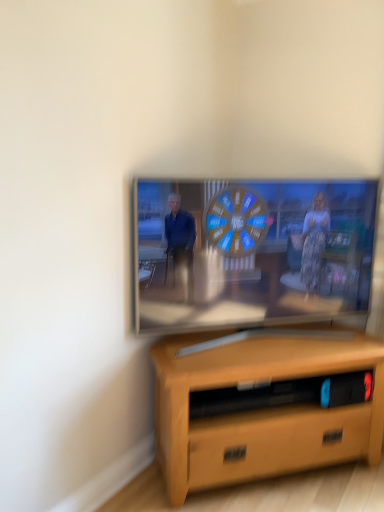
Question: Would you say matte wooden tv at center is inside or outside light brown wood desk at lower center?

Choices:
 (A) inside
 (B) outside

Answer: (B)

Question: In the image, is matte wooden tv at center positioned in front of or behind light brown wood desk at lower center?

Choices:
 (A) front
 (B) behind

Answer: (B)

Question: From a real-world perspective, is matte wooden tv at center positioned above or below light brown wood desk at lower center?

Choices:
 (A) above
 (B) below

Answer: (A)

Question: Is light brown wood desk at lower center wider or thinner than matte wooden tv at center?

Choices:
 (A) wide
 (B) thin

Answer: (A)

Question: Considering their positions, is light brown wood desk at lower center located in front of or behind matte wooden tv at center?

Choices:
 (A) front
 (B) behind

Answer: (A)

Question: Based on their positions, is light brown wood desk at lower center located to the left or right of matte wooden tv at center?

Choices:
 (A) right
 (B) left

Answer: (A)

Question: Is point (208, 440) closer or farther from the camera than point (135, 245)?

Choices:
 (A) farther
 (B) closer

Answer: (B)